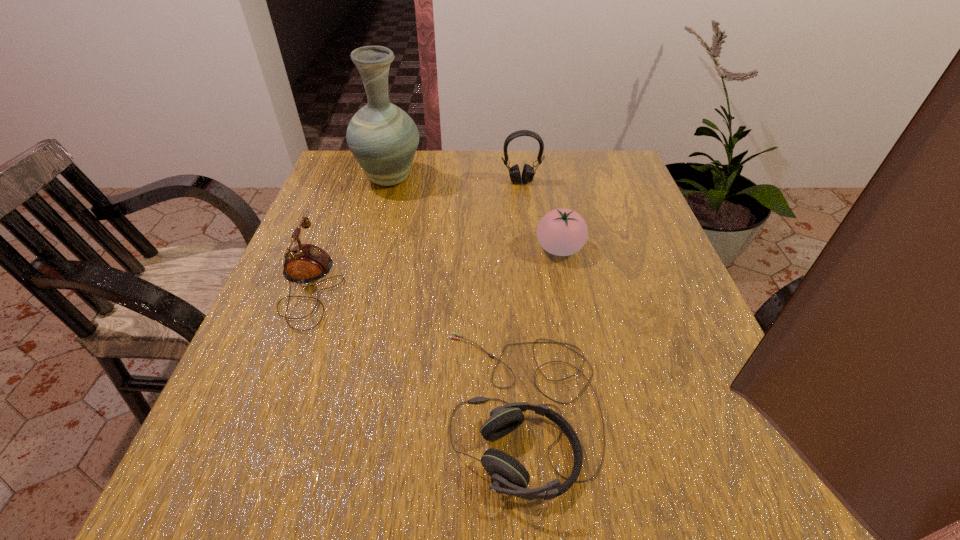
Identify the location of vacant space at the far edge of the desktop. The height and width of the screenshot is (540, 960). pyautogui.click(x=466, y=168).

What are the coordinates of `free space at the left edge of the desktop` in the screenshot? It's located at (333, 258).

This screenshot has height=540, width=960. In the image, there is a desktop. Identify the location of free space at the right edge. (674, 263).

This screenshot has height=540, width=960. In the image, there is a desktop. In order to click on vacant space at the far left corner in this screenshot , I will do `click(337, 197)`.

The image size is (960, 540). Identify the location of vacant space at the near left corner. (269, 458).

The height and width of the screenshot is (540, 960). In order to click on vacant space at the far right corner of the desktop in this screenshot , I will do `click(598, 157)`.

The width and height of the screenshot is (960, 540). Find the location of `free space between the tomato and the shorter headset`. free space between the tomato and the shorter headset is located at coordinates (540, 328).

Locate an element on the screen. This screenshot has height=540, width=960. empty space that is in between the tomato and the farther headset is located at coordinates (540, 215).

Image resolution: width=960 pixels, height=540 pixels. I want to click on vacant point located between the tomato and the taller headset, so click(540, 215).

The height and width of the screenshot is (540, 960). In order to click on vacant area that lies between the telephone and the pitcher in this screenshot , I will do `click(349, 233)`.